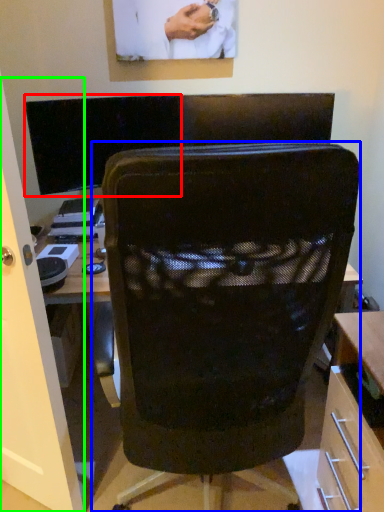
Question: Which is farther away from computer monitor (highlighted by a red box)? chair (highlighted by a blue box) or glass door (highlighted by a green box)?

Choices:
 (A) chair
 (B) glass door

Answer: (A)